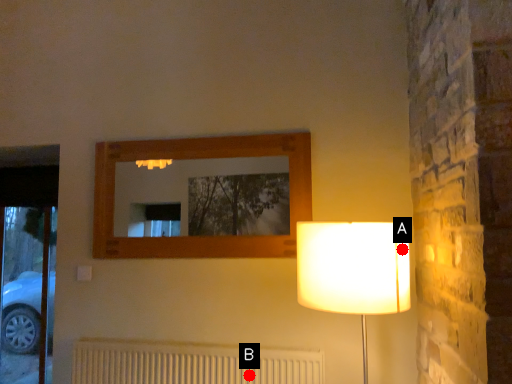
Question: Two points are circled on the image, labeled by A and B beside each circle. Which point appears farthest from the camera in this image?

Choices:
 (A) A is further
 (B) B is further

Answer: (B)